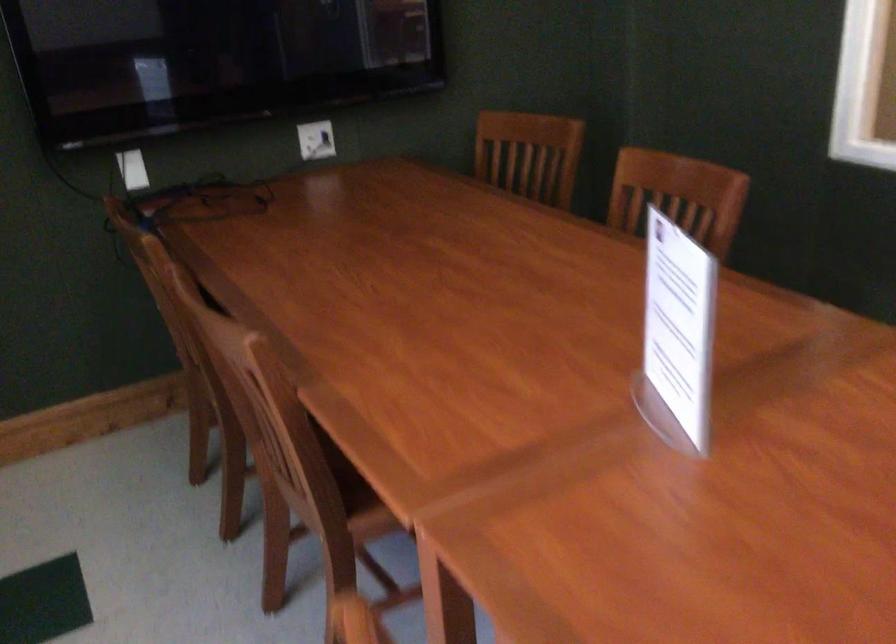
The image size is (896, 644). What are the coordinates of `tabletop sign holder` in the screenshot? It's located at (677, 335).